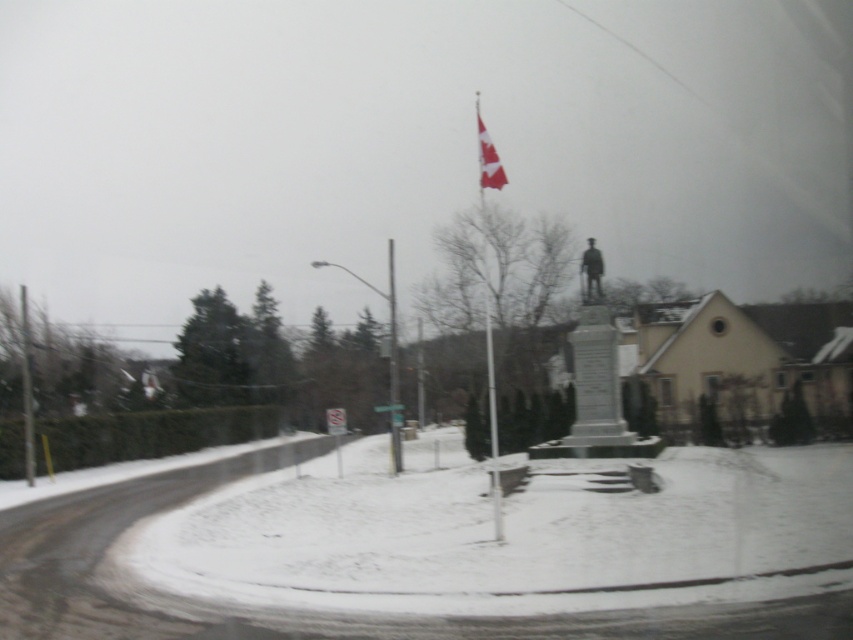
Between metallic pole at left and white plastic sign at center, which one is positioned higher?

metallic pole at left is above.

Can you confirm if metallic pole at left is thinner than white plastic sign at center?

In fact, metallic pole at left might be wider than white plastic sign at center.

Is point (25, 321) less distant than point (378, 408)?

That is False.

Locate an element on the screen. metallic pole at left is located at coordinates (26, 392).

Is white metallic flag pole at center to the right of white plastic sign at center from the viewer's perspective?

Yes, white metallic flag pole at center is to the right of white plastic sign at center.

Which is below, white metallic flag pole at center or white plastic sign at center?

white plastic sign at center is lower down.

Is point (485, 129) farther from viewer compared to point (386, 410)?

Yes, point (485, 129) is behind point (386, 410).

Where is `white metallic flag pole at center`? Image resolution: width=853 pixels, height=640 pixels. white metallic flag pole at center is located at coordinates (489, 305).

Which is in front, point (392, 454) or point (376, 404)?

Point (392, 454)

Does metallic pole at center have a smaller size compared to white plastic sign at center?

Incorrect, metallic pole at center is not smaller in size than white plastic sign at center.

The image size is (853, 640). In order to click on metallic pole at center in this screenshot , I will do `click(393, 369)`.

The image size is (853, 640). Identify the location of metallic pole at center. (393, 369).